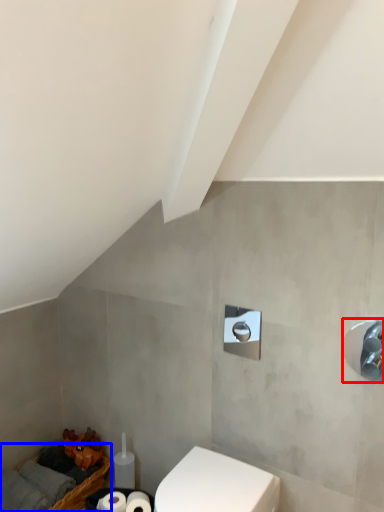
Question: Among these objects, which one is farthest to the camera, shower (highlighted by a red box) or basket (highlighted by a blue box)?

Choices:
 (A) shower
 (B) basket

Answer: (B)